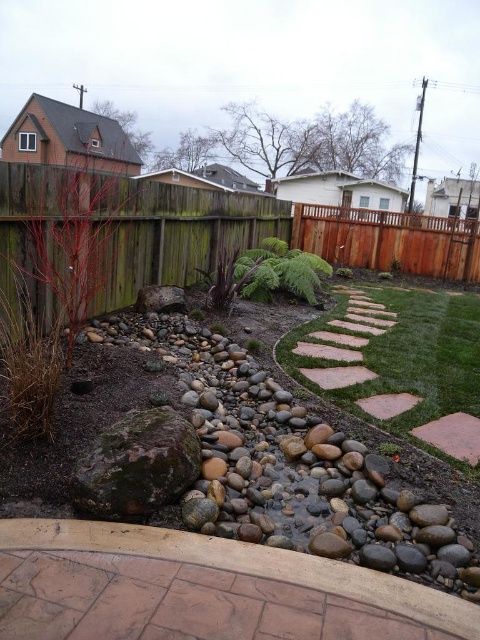
You are standing in the backyard garden and want to know if the green wood fence at left is positioned lower than the brown wood fence at upper right. Can you determine this based on the scene?

The green wood fence at left is below the brown wood fence at upper right, so yes, it is positioned lower than the brown wood fence at upper right.

You are standing at the center of the stone pathway in the backyard garden. You want to walk towards the green wood fence at left. In which direction should you head?

You should head towards the left direction to reach the green wood fence at left, as it is located at the left side of the scene.

Consider the image. You are standing at the center of the stone pathway in the backyard garden. Looking towards the green wood fence at left, which direction should you walk to reach it?

The green wood fence at left is located at point (118, 234) in 2D coordinates, so you should walk towards the left direction to reach it.